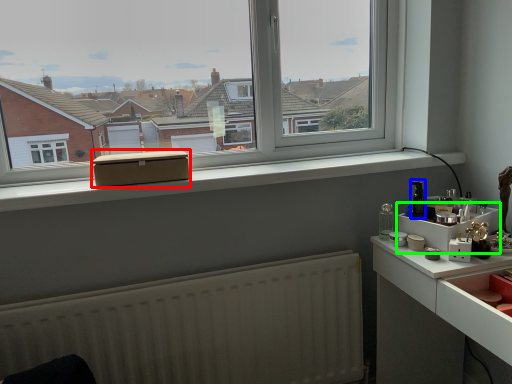
Question: Which is farther away from box (highlighted by a red box)? appliance (highlighted by a blue box) or shelf (highlighted by a green box)?

Choices:
 (A) appliance
 (B) shelf

Answer: (A)